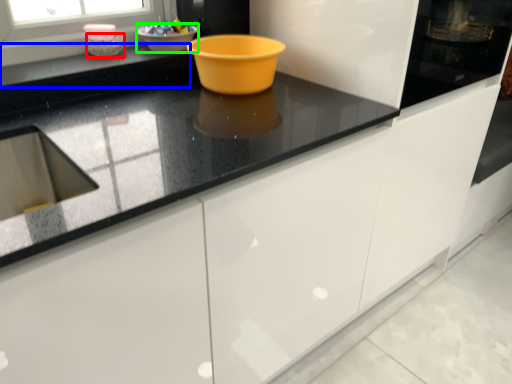
Question: Estimate the real-world distances between objects in this image. Which object is farther from basin (highlighted by a red box), counter top (highlighted by a blue box) or basin (highlighted by a green box)?

Choices:
 (A) counter top
 (B) basin

Answer: (B)